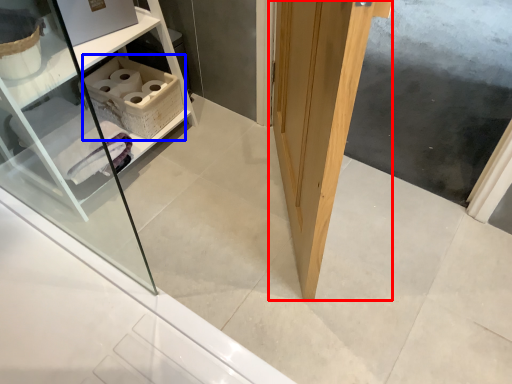
Question: Which object appears closest to the camera in this image, door (highlighted by a red box) or cabinetry (highlighted by a blue box)?

Choices:
 (A) door
 (B) cabinetry

Answer: (A)